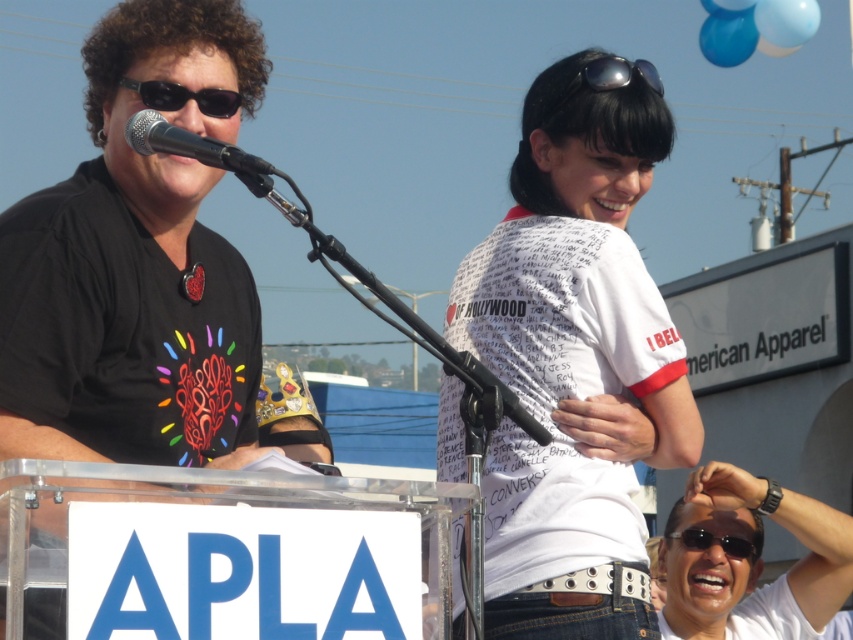
Question: Which of the following is the farthest from the observer?

Choices:
 (A) (225, 97)
 (B) (612, 72)

Answer: (B)

Question: Observing the image, what is the correct spatial positioning of black plastic sunglasses at left in reference to sunglasses at upper center?

Choices:
 (A) below
 (B) above

Answer: (A)

Question: From the image, what is the correct spatial relationship of metallic silver microphone at left in relation to black plastic sunglasses at lower center?

Choices:
 (A) below
 (B) above

Answer: (B)

Question: Does white printed t-shirt at center have a greater width compared to black plastic sunglasses at left?

Choices:
 (A) yes
 (B) no

Answer: (A)

Question: Which of these objects is positioned farthest from the white matte sunglasses at upper right?

Choices:
 (A) metallic silver microphone at left
 (B) black plastic sunglasses at lower center
 (C) black plastic sunglasses at left
 (D) white printed t-shirt at center

Answer: (A)

Question: Which point is closer to the camera taking this photo?

Choices:
 (A) (642, 60)
 (B) (769, 586)
 (C) (177, 148)

Answer: (C)